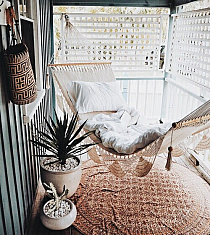
The height and width of the screenshot is (235, 210). I want to click on pillow, so click(x=105, y=97).